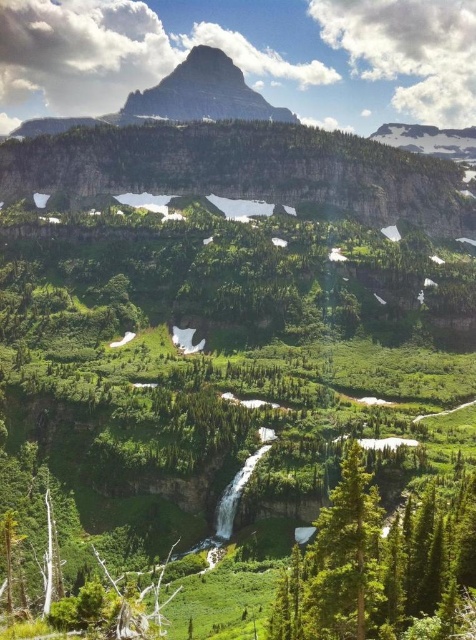
Measure the distance between green matte tree at lower center and camera.

green matte tree at lower center is 54.48 meters from camera.

Between green matte tree at lower center and rugged granite mountain at upper center, which one has less height?

green matte tree at lower center is shorter.

Describe the element at coordinates (376, 563) in the screenshot. I see `green matte tree at lower center` at that location.

This screenshot has width=476, height=640. What are the coordinates of `green matte tree at lower center` in the screenshot? It's located at (376, 563).